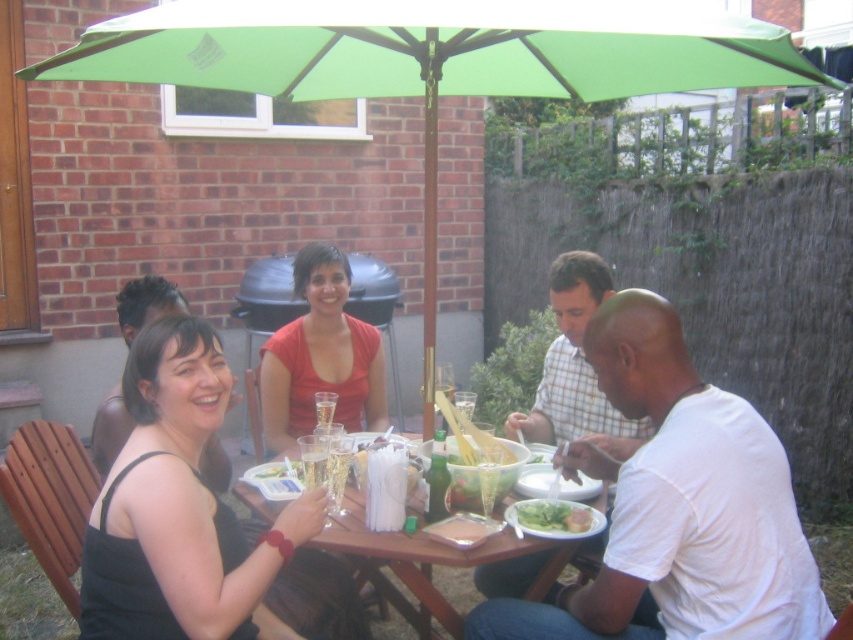
Question: Which point is farther to the camera?

Choices:
 (A) (567, 291)
 (B) (224, 586)

Answer: (A)

Question: Among these objects, which one is nearest to the camera?

Choices:
 (A) white cotton shirt at lower right
 (B) black fabric dress at lower left
 (C) white cotton shirt at center

Answer: (B)

Question: Which point is farther to the camera?

Choices:
 (A) white cotton shirt at center
 (B) black fabric dress at lower left
 (C) wooden table at center
 (D) green fabric umbrella at center

Answer: (A)

Question: Where is green fabric umbrella at center located in relation to white cotton shirt at lower right in the image?

Choices:
 (A) above
 (B) below

Answer: (A)

Question: Is white cotton shirt at lower right closer to the viewer compared to white cotton shirt at center?

Choices:
 (A) no
 (B) yes

Answer: (B)

Question: From the image, what is the correct spatial relationship of green fabric umbrella at center in relation to black fabric dress at lower left?

Choices:
 (A) above
 (B) below

Answer: (A)